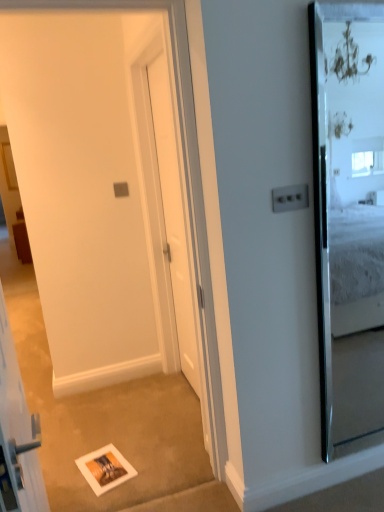
Question: Is white glossy elevator at lower left bigger than clear glass mirror at right?

Choices:
 (A) no
 (B) yes

Answer: (B)

Question: Would you say white glossy elevator at lower left is outside clear glass mirror at right?

Choices:
 (A) yes
 (B) no

Answer: (A)

Question: Is white glossy elevator at lower left to the right of clear glass mirror at right from the viewer's perspective?

Choices:
 (A) no
 (B) yes

Answer: (A)

Question: Does white glossy elevator at lower left have a greater height compared to clear glass mirror at right?

Choices:
 (A) yes
 (B) no

Answer: (B)

Question: From a real-world perspective, does white glossy elevator at lower left stand above clear glass mirror at right?

Choices:
 (A) no
 (B) yes

Answer: (A)

Question: Is white glossy elevator at lower left next to clear glass mirror at right and touching it?

Choices:
 (A) no
 (B) yes

Answer: (A)

Question: From a real-world perspective, is clear glass mirror at right beneath white matte barn door at center?

Choices:
 (A) no
 (B) yes

Answer: (B)

Question: Is white matte barn door at center completely or partially inside clear glass mirror at right?

Choices:
 (A) no
 (B) yes

Answer: (A)

Question: Is clear glass mirror at right behind white matte barn door at center?

Choices:
 (A) no
 (B) yes

Answer: (B)

Question: Does clear glass mirror at right turn towards white matte barn door at center?

Choices:
 (A) no
 (B) yes

Answer: (A)

Question: From the image's perspective, does clear glass mirror at right appear lower than white matte barn door at center?

Choices:
 (A) yes
 (B) no

Answer: (B)

Question: Does clear glass mirror at right appear on the right side of white matte barn door at center?

Choices:
 (A) yes
 (B) no

Answer: (A)

Question: Can you confirm if white glossy elevator at lower left is shorter than white glossy picture frame at lower center?

Choices:
 (A) no
 (B) yes

Answer: (A)